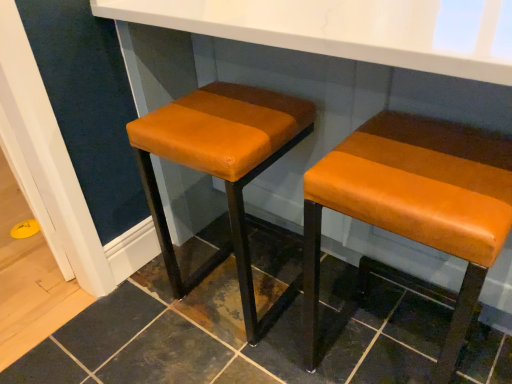
Where is `vacant area on top of orange leather stool at center, the 2th stool from the right (from a real-world perspective)`? This screenshot has width=512, height=384. vacant area on top of orange leather stool at center, the 2th stool from the right (from a real-world perspective) is located at coordinates (220, 115).